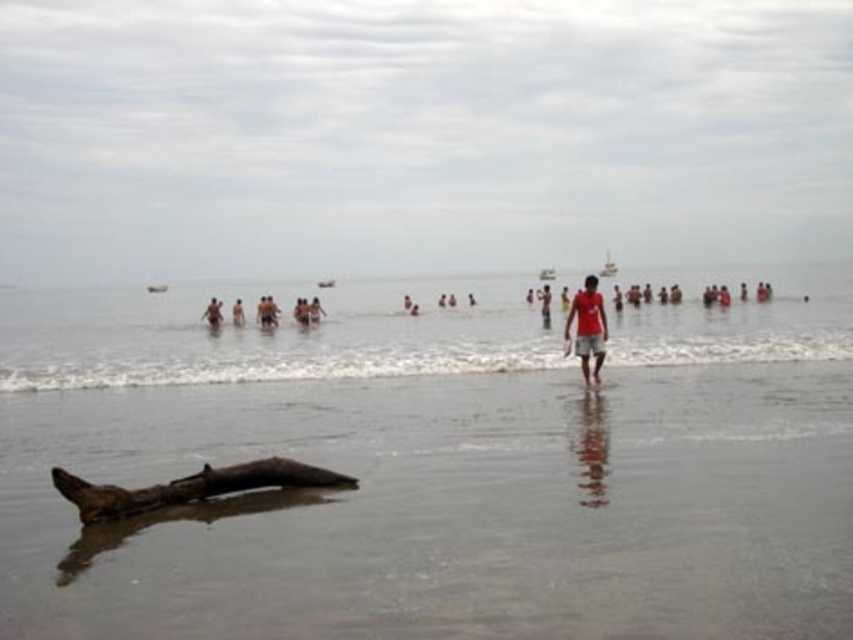
You are a photographer trying to capture a photo of the smooth skin person at center while ensuring the brown wood log at lower center doesn not block the view. Can you position yourself so that the log is entirely out of the frame?

The brown wood log at lower center is wider than the smooth skin person at center. Since the log is wider, positioning yourself to exclude it entirely might be challenging unless you move far enough to the side where the log is no longer in the frame while keeping the person centered.